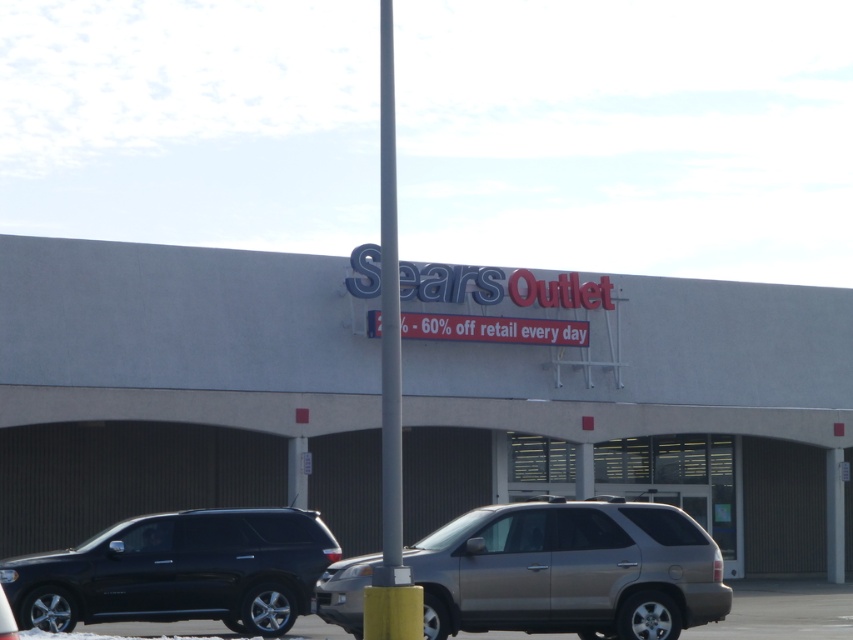
The image size is (853, 640). What do you see at coordinates (569, 570) in the screenshot?
I see `metallic silver minivan at center` at bounding box center [569, 570].

Between metallic silver minivan at center and shiny black suv at lower left, which one is positioned lower?

shiny black suv at lower left is lower down.

Between point (614, 609) and point (318, 540), which one is positioned in front?

Positioned in front is point (614, 609).

Locate an element on the screen. metallic silver minivan at center is located at coordinates (569, 570).

This screenshot has height=640, width=853. Find the location of `shiny black suv at lower left`. shiny black suv at lower left is located at coordinates (178, 572).

Is point (125, 531) behind point (311, 630)?

No.

Is point (151, 579) more distant than point (202, 621)?

No, (151, 579) is closer to viewer.

Find the location of a particular element. shiny black suv at lower left is located at coordinates (178, 572).

Can you confirm if metallic silver minivan at center is thinner than metallic gray suv at lower center?

Yes.

In the scene shown: Between metallic silver minivan at center and metallic gray suv at lower center, which one appears on the left side from the viewer's perspective?

From the viewer's perspective, metallic silver minivan at center appears more on the left side.

Measure the distance between metallic silver minivan at center and camera.

metallic silver minivan at center and camera are 18.58 meters apart.

I want to click on metallic silver minivan at center, so click(569, 570).